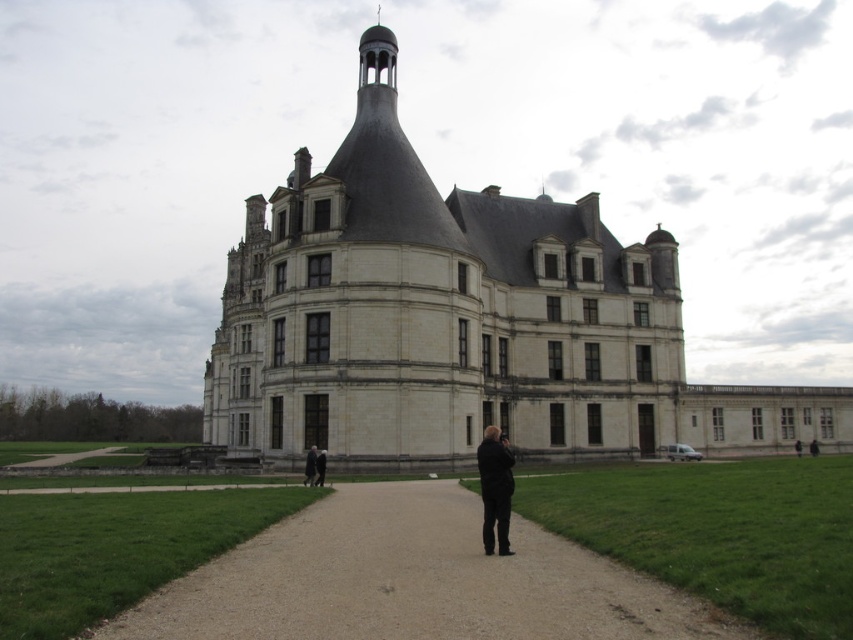
You are a tour guide leading a group to the chateau. You notice two visitors wearing jackets. One is wearing a black leather jacket at center and another is wearing a dark brown leather jacket at lower right. Which visitor is standing to the left of the other?

The black leather jacket at center is positioned on the left side of dark brown leather jacket at lower right, so the visitor wearing the black leather jacket at center is standing to the left of the one wearing the dark brown leather jacket at lower right.

You are standing on the gravel pathway leading to the chateau and notice two jackets at the lower right corner of your view. Which jacket is nearer to you, the dark brown leather jacket at lower right or the black leather jacket at lower right?

The dark brown leather jacket at lower right is closer to the viewer than the black leather jacket at lower right, so the dark brown one is nearer to you.